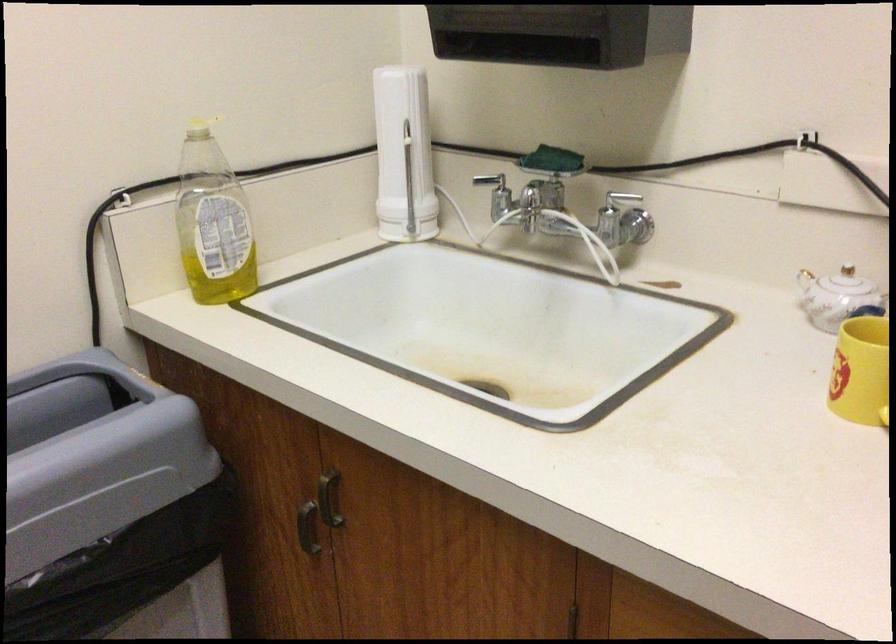
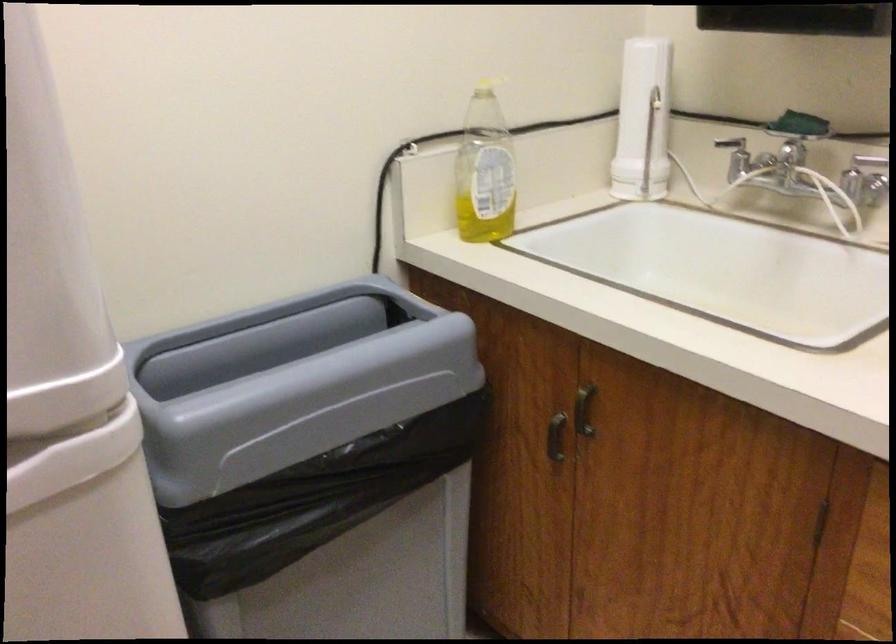
Question: The camera is either moving clockwise (left) or counter-clockwise (right) around the object. The first image is from the beginning of the video and the second image is from the end. Is the camera moving left or right when shooting the video?

Choices:
 (A) Left
 (B) Right

Answer: (B)